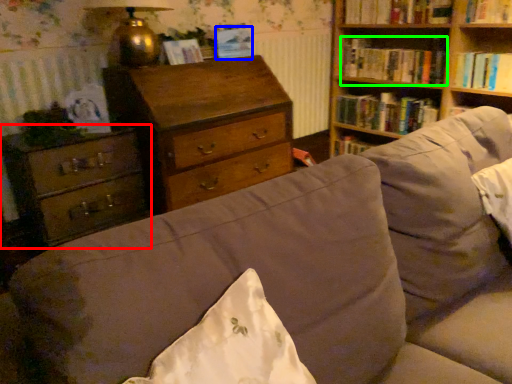
Question: Which object is the closest to the chest of drawers (highlighted by a red box)? Choose among these: paperback book (highlighted by a blue box) or book (highlighted by a green box).

Choices:
 (A) paperback book
 (B) book

Answer: (A)